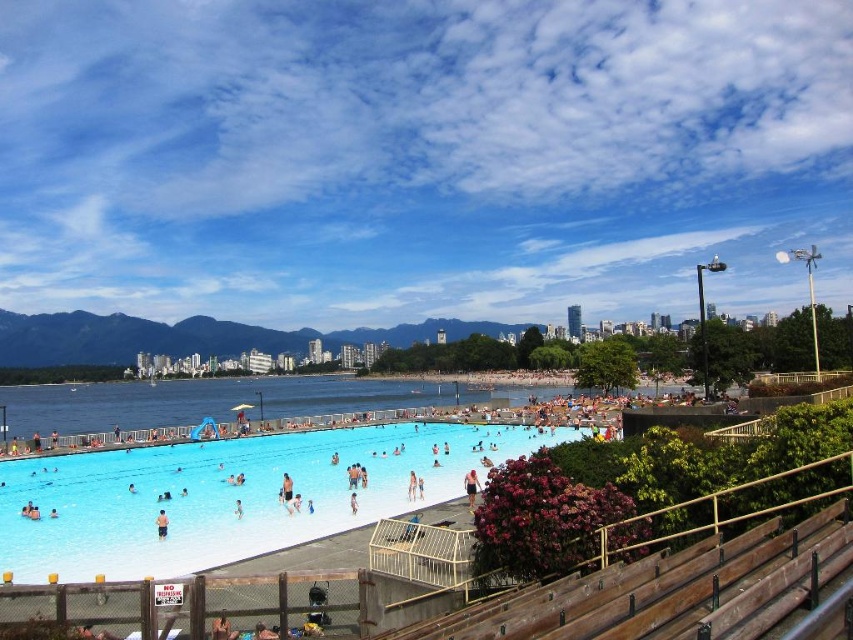
Who is shorter, white cotton shorts at center or light blue fabric swim trunks at center?

light blue fabric swim trunks at center is shorter.

Is white cotton shorts at center smaller than light blue fabric swim trunks at center?

No, white cotton shorts at center is not smaller than light blue fabric swim trunks at center.

Between point (474, 472) and point (164, 536), which one is positioned behind?

The point (474, 472) is more distant.

The height and width of the screenshot is (640, 853). I want to click on white cotton shorts at center, so click(471, 486).

Who is positioned more to the right, clear plastic pool at lower center or light blue fabric swim trunks at center?

From the viewer's perspective, clear plastic pool at lower center appears more on the right side.

Consider the image. Can you confirm if clear plastic pool at lower center is wider than light blue fabric swim trunks at center?

→ Yes, clear plastic pool at lower center is wider than light blue fabric swim trunks at center.

Based on the photo, who is more distant from viewer, (183, 496) or (163, 513)?

Point (183, 496)

I want to click on clear plastic pool at lower center, so click(230, 496).

Is clear plastic pool at lower center smaller than white cotton shorts at center?

Incorrect, clear plastic pool at lower center is not smaller in size than white cotton shorts at center.

Who is positioned more to the right, clear plastic pool at lower center or white cotton shorts at center?

Positioned to the right is white cotton shorts at center.

Locate an element on the screen. clear plastic pool at lower center is located at coordinates (230, 496).